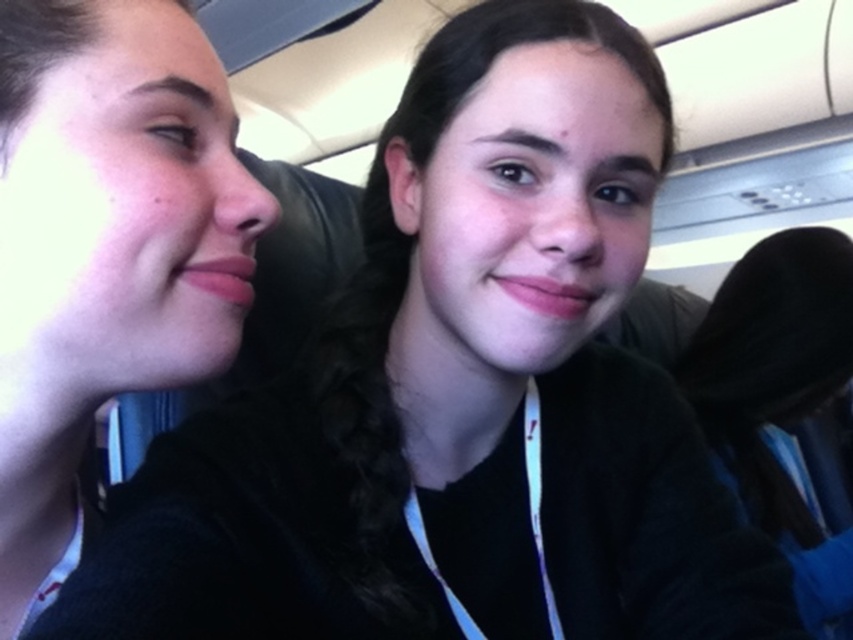
You are sitting in an airplane seat and see two black fabrics in front of you. The black fabric at left and the black fabric at right. Which one is closer to you?

The black fabric at left is closer to you because it is in front of the black fabric at right.

You are sitting in an airplane seat and notice two black fabrics. One is labeled as the black fabric at left and the other as the black fabric at right. Based on their positions, which one is shorter?

The black fabric at left is shorter than the black fabric at right according to the description.

You are a passenger seated in an airplane cabin and want to place a small item on the seat next to you. The seat is located at point [105,248]. There is a black fabric at left at that point. Is there enough space to place your item there?

At point [105,248] lies black fabric at left, so placing the item there may not be ideal as the black fabric at left is already occupying that space.